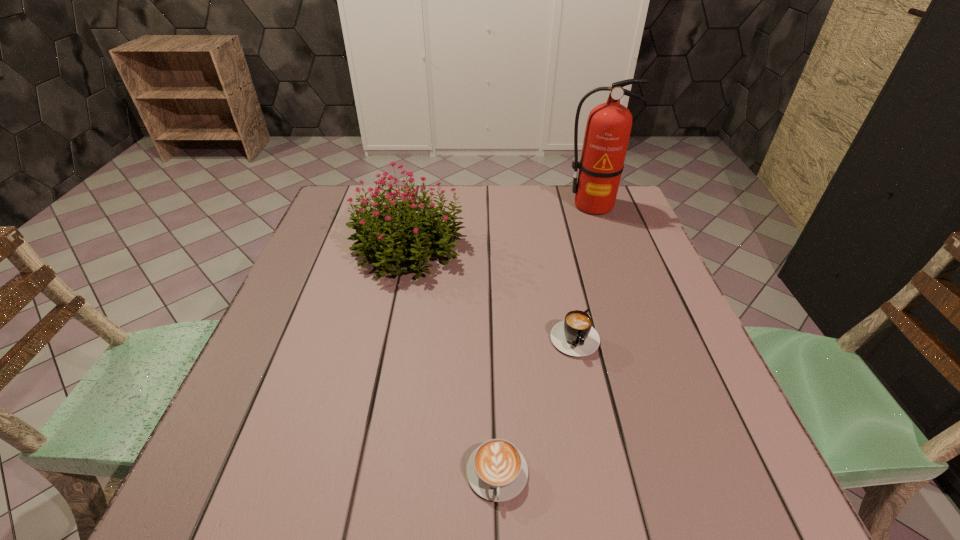
You are a GUI agent. You are given a task and a screenshot of the screen. Output one action in this format:
    pyautogui.click(x=<x>, y=<y>)
    Task: Click on the fire extinguisher
    
    Given the screenshot: What is the action you would take?
    pyautogui.click(x=608, y=128)

Where is `the third shortest object`? the third shortest object is located at coordinates (413, 233).

Where is `bouquet`? This screenshot has width=960, height=540. bouquet is located at coordinates (413, 233).

What are the coordinates of `the second nearest object` in the screenshot? It's located at (575, 336).

In order to click on the farther cappuccino in this screenshot , I will do `click(575, 336)`.

The width and height of the screenshot is (960, 540). In order to click on the left cappuccino in this screenshot , I will do `click(497, 471)`.

Find the location of a particular element. The image size is (960, 540). the nearest object is located at coordinates tap(497, 471).

What are the coordinates of `vacant space located 0.240m on the side of the fire extinguisher with the nozzle and handle` in the screenshot? It's located at (615, 269).

Where is `free space located 0.080m on the right of the third shortest object`? This screenshot has width=960, height=540. free space located 0.080m on the right of the third shortest object is located at coordinates (498, 248).

Where is `free space located 0.260m with the handle on the side of the right cappuccino`? This screenshot has height=540, width=960. free space located 0.260m with the handle on the side of the right cappuccino is located at coordinates (607, 489).